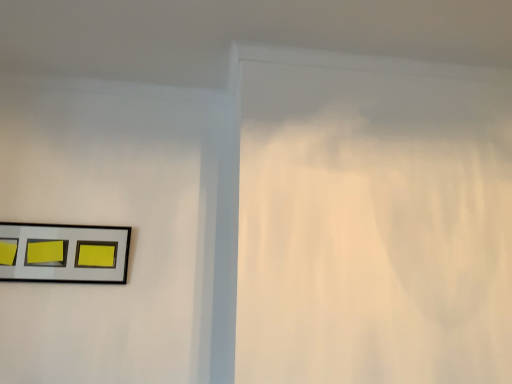
The image size is (512, 384). What do you see at coordinates (64, 253) in the screenshot?
I see `metallic silver picture frame at upper left` at bounding box center [64, 253].

Locate an element on the screen. The image size is (512, 384). metallic silver picture frame at upper left is located at coordinates (64, 253).

Locate an element on the screen. The height and width of the screenshot is (384, 512). metallic silver picture frame at upper left is located at coordinates (64, 253).